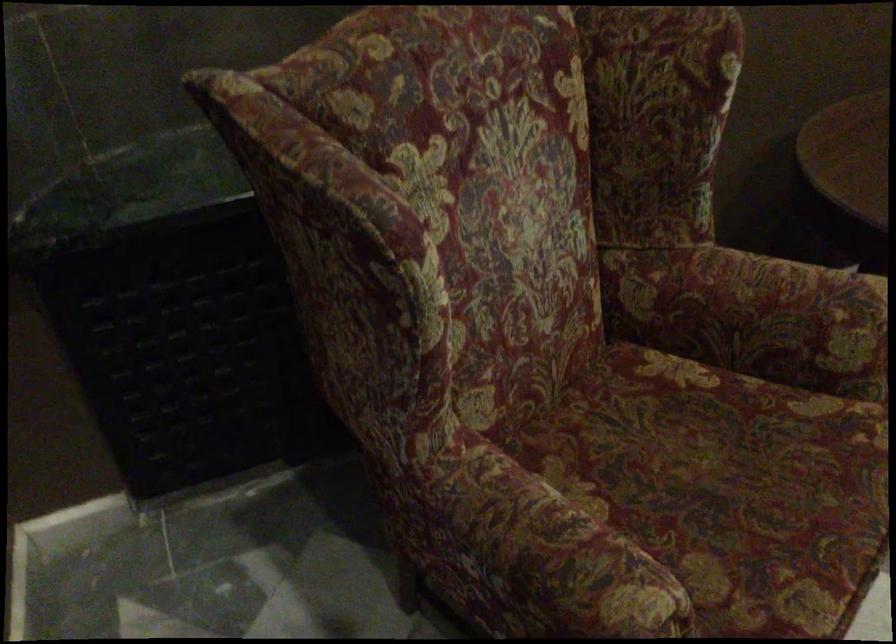
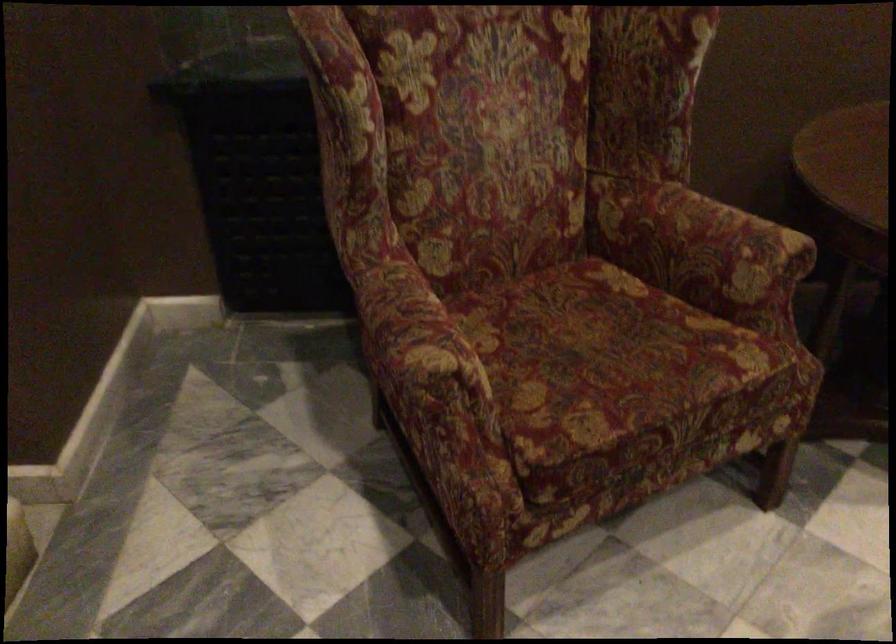
Question: Based on the continuous images, in which direction is the camera rotating? Reply with the corresponding letter.

Choices:
 (A) Left
 (B) Right
 (C) Up
 (D) Down

Answer: (A)